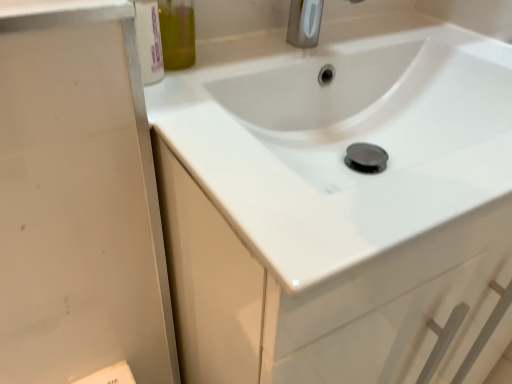
At what (x,y) coordinates should I click in order to perform the action: click on free space to the left of satin nickel faucet at upper center. Please return your answer as a coordinate pair (x, y). This screenshot has width=512, height=384. Looking at the image, I should click on (232, 51).